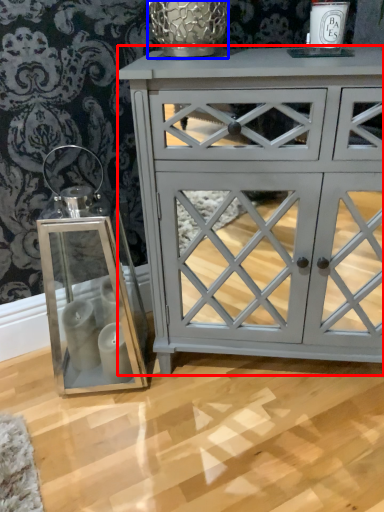
Question: Which object is closer to the camera taking this photo, chest of drawers (highlighted by a red box) or glass vase (highlighted by a blue box)?

Choices:
 (A) chest of drawers
 (B) glass vase

Answer: (A)